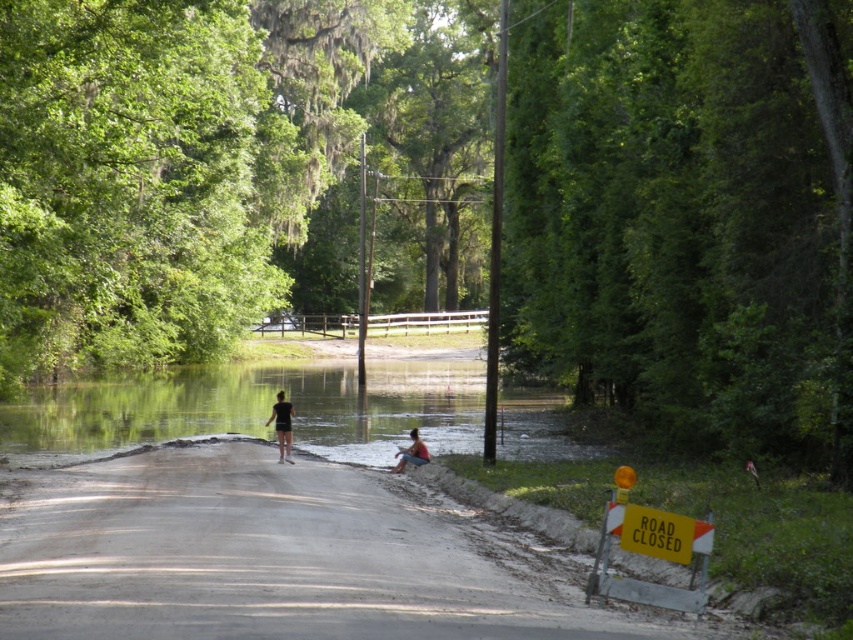
Between black matte shorts at center and blue denim shorts at center, which one appears on the right side from the viewer's perspective?

blue denim shorts at center

Is black matte shorts at center positioned before blue denim shorts at center?

Yes, black matte shorts at center is closer to the viewer.

Find the location of a particular element. Image resolution: width=853 pixels, height=640 pixels. black matte shorts at center is located at coordinates (282, 426).

Is clear water at center in front of blue denim shorts at center?

No, it is not.

Is clear water at center positioned at the back of blue denim shorts at center?

Yes, it is.

Who is more forward, (x=532, y=433) or (x=415, y=433)?

Point (x=415, y=433)

The image size is (853, 640). I want to click on clear water at center, so point(258,406).

Who is shorter, clear water at center or black matte shorts at center?

With less height is black matte shorts at center.

Between point (165, 397) and point (288, 452), which one is positioned behind?

Point (165, 397)

Between point (245, 394) and point (265, 420), which one is positioned behind?

The point (245, 394) is behind.

Identify the location of clear water at center. (258, 406).